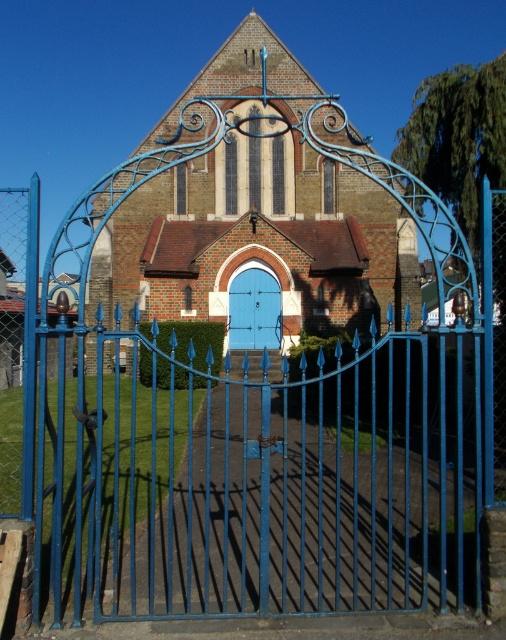
Image resolution: width=506 pixels, height=640 pixels. What do you see at coordinates (259, 240) in the screenshot?
I see `brick church at center` at bounding box center [259, 240].

Between point (271, 268) and point (255, 326), which one is positioned in front?

Positioned in front is point (271, 268).

The width and height of the screenshot is (506, 640). What do you see at coordinates (259, 240) in the screenshot? I see `brick church at center` at bounding box center [259, 240].

I want to click on brick church at center, so click(259, 240).

Who is positioned more to the right, blue metal gate at center or brick church at center?

blue metal gate at center

Does blue metal gate at center appear on the left side of brick church at center?

In fact, blue metal gate at center is to the right of brick church at center.

I want to click on blue metal gate at center, so click(266, 474).

Find the location of a particular element. The image size is (506, 640). blue metal gate at center is located at coordinates (266, 474).

Measure the distance from blue metal gate at center to blue matte door at center.

blue metal gate at center and blue matte door at center are 32.85 feet apart from each other.

Does point (232, 508) come farther from viewer compared to point (242, 337)?

No.

Find the location of a particular element. The image size is (506, 640). blue metal gate at center is located at coordinates (266, 474).